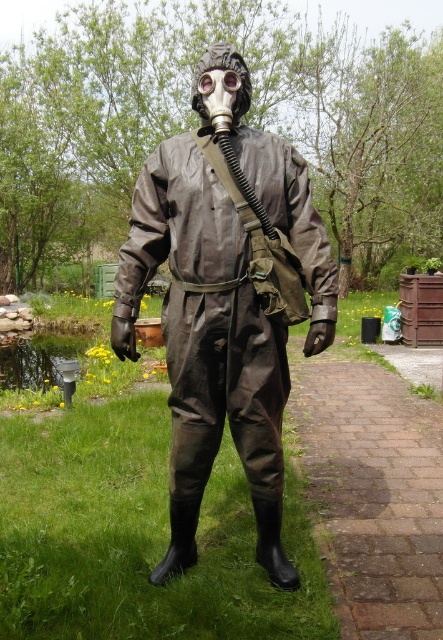
You are a safety inspector assessing the scene. You notice the brick pavement at lower right and the transparent plastic goggles at center. Which object is wider in this scenario?

The brick pavement at lower right is wider than the transparent plastic goggles at center according to the description.

You are a safety inspector assessing the scene. You notice the brick pavement at lower right and the transparent plastic goggles at center. Which object is closer to your current position?

The brick pavement at lower right is further to the viewer than transparent plastic goggles at center, so the transparent plastic goggles at center is closer to your current position.

You are a drone operator controlling a drone that needs to hover exactly 2 meters above the matte brown jumpsuit at center. Given the distance between the drone and the jumpsuit, can the drone safely hover at the desired altitude without being too close or too far?

The distance between the matte brown jumpsuit at center and the camera is 2.38 meters. Since the drone needs to hover 2 meters above the jumpsuit, it would be slightly closer than the current camera distance. However, the difference is minimal, so the drone can safely hover at the desired altitude as long as it adjusts its position accordingly.